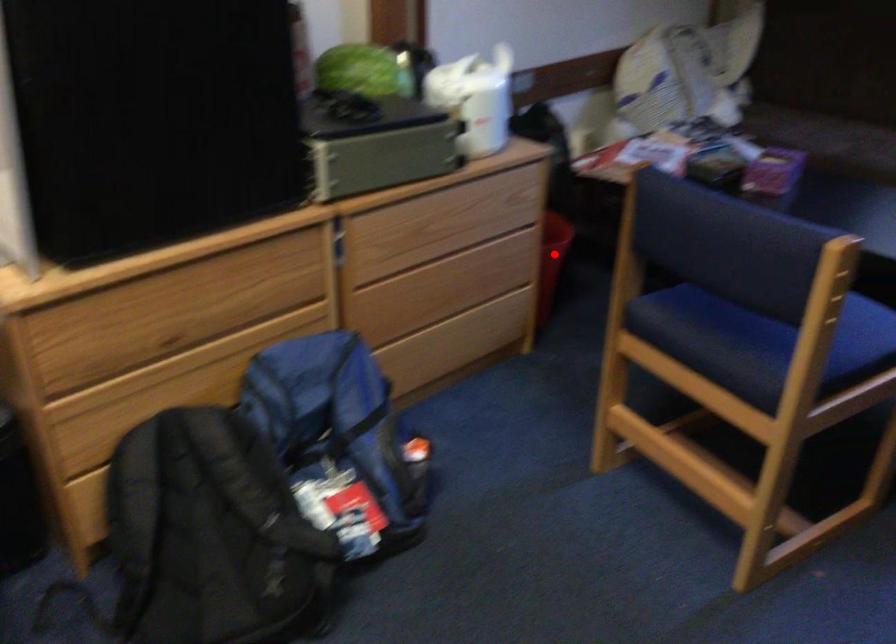
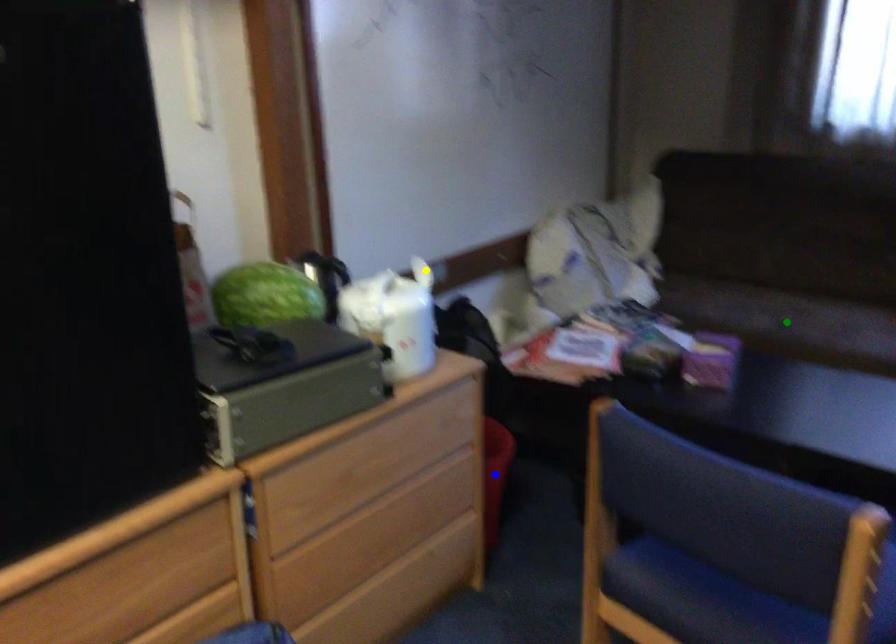
Question: I am providing you with two images of the same scene from different viewpoints. A red point is marked on the first image. You are given multiple points on the second image. Can you choose the point in image 2 that corresponds to the point in image 1?

Choices:
 (A) yellow point
 (B) blue point
 (C) green point

Answer: (B)